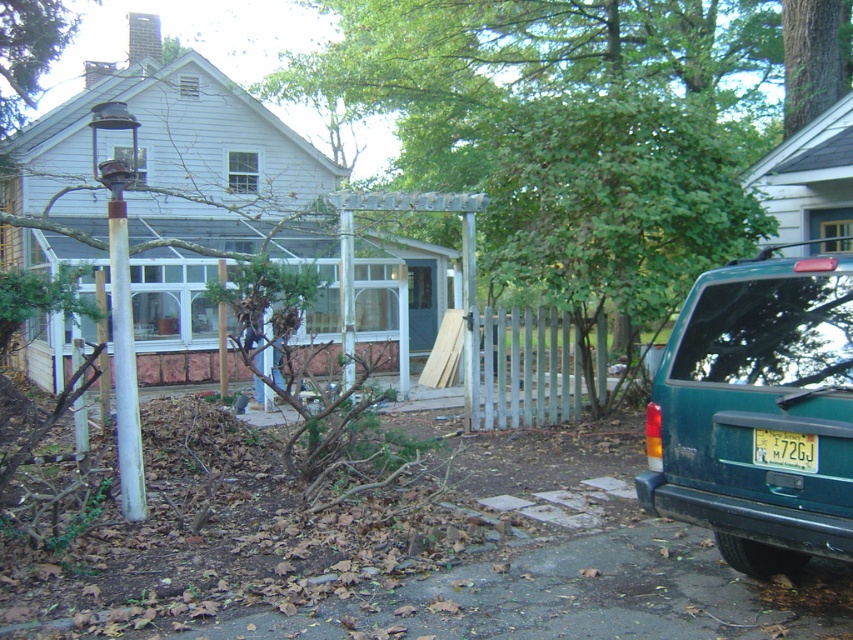
Does green leafy tree at center have a greater height compared to yellow matte license plate at lower right?

Indeed, green leafy tree at center has a greater height compared to yellow matte license plate at lower right.

Is point (463, 1) positioned before point (801, 445)?

No, it is behind (801, 445).

Where is `green leafy tree at center`? The height and width of the screenshot is (640, 853). green leafy tree at center is located at coordinates [x=585, y=124].

Does teal matte suv at lower right have a greater height compared to yellow matte license plate at lower right?

Yes, teal matte suv at lower right is taller than yellow matte license plate at lower right.

Describe the element at coordinates (756, 412) in the screenshot. I see `teal matte suv at lower right` at that location.

Locate an element on the screen. teal matte suv at lower right is located at coordinates (756, 412).

Does green leafy tree at center lie behind teal matte suv at lower right?

Yes, green leafy tree at center is further from the viewer.

The width and height of the screenshot is (853, 640). I want to click on green leafy tree at center, so click(x=585, y=124).